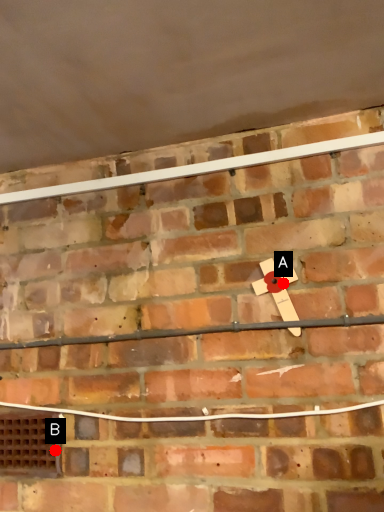
Question: Two points are circled on the image, labeled by A and B beside each circle. Which point is further to the camera?

Choices:
 (A) A is further
 (B) B is further

Answer: (B)